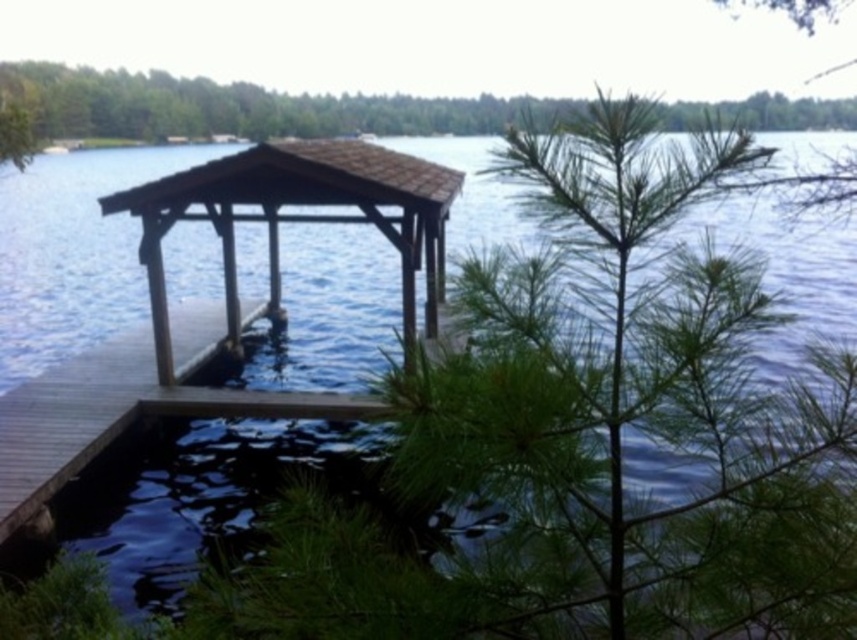
Who is taller, green needle-like tree at upper center or brown wooden dock at lower left?

green needle-like tree at upper center is taller.

Which is above, green needle-like tree at upper center or brown wooden dock at lower left?

green needle-like tree at upper center is higher up.

The image size is (857, 640). What are the coordinates of `green needle-like tree at upper center` in the screenshot? It's located at (240, 106).

Between green needle-like tree at upper center and brown wooden gazebo at center, which one appears on the right side from the viewer's perspective?

brown wooden gazebo at center

Between green needle-like tree at upper center and brown wooden gazebo at center, which one is positioned higher?

green needle-like tree at upper center

Is point (765, 120) more distant than point (418, 266)?

Yes, it is behind point (418, 266).

Locate an element on the screen. The width and height of the screenshot is (857, 640). green needle-like tree at upper center is located at coordinates (240, 106).

Between point (225, 285) and point (34, 416), which one is positioned in front?

Point (34, 416) is in front.

Who is lower down, brown wooden gazebo at center or brown wooden dock at lower left?

brown wooden dock at lower left

Find the location of a particular element. The height and width of the screenshot is (640, 857). brown wooden gazebo at center is located at coordinates (297, 216).